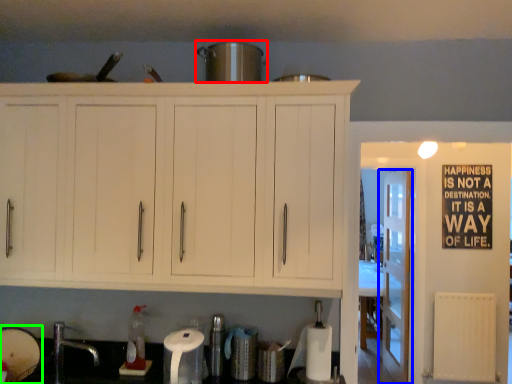
Question: Considering the real-world distances, which object is farthest from appliance (highlighted by a red box)? door (highlighted by a blue box) or appliance (highlighted by a green box)?

Choices:
 (A) door
 (B) appliance

Answer: (A)